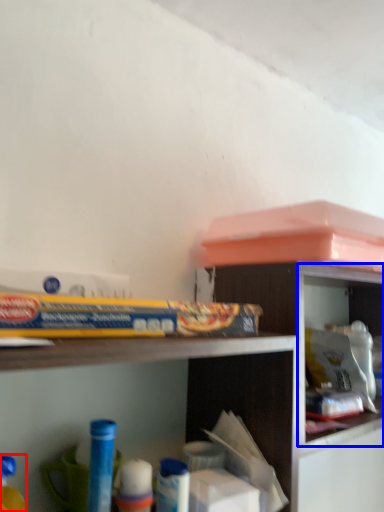
Question: Which object is closer to the camera taking this photo, toy (highlighted by a red box) or cabinet (highlighted by a blue box)?

Choices:
 (A) toy
 (B) cabinet

Answer: (A)